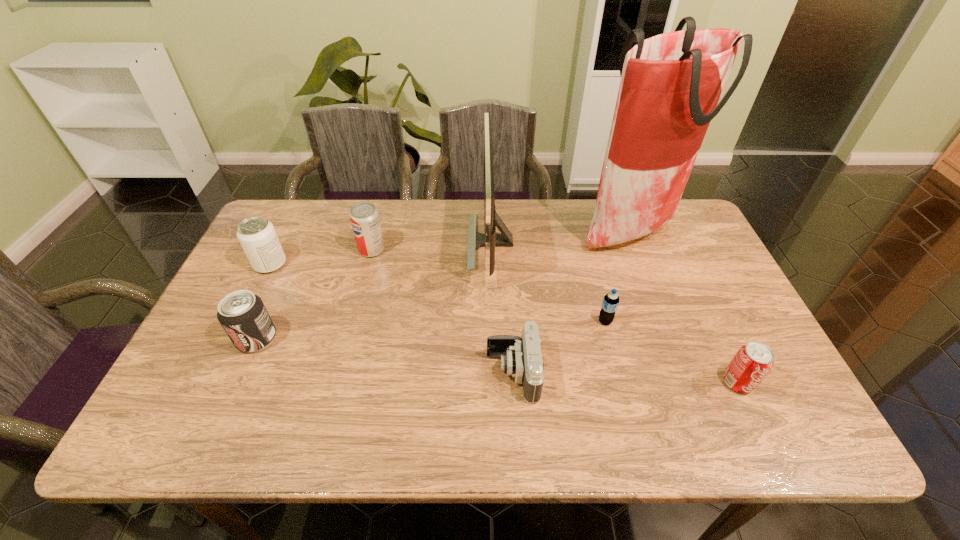
What are the coordinates of `soda located at the right edge` in the screenshot? It's located at (750, 365).

The image size is (960, 540). Identify the location of object present at the far right corner. click(x=671, y=83).

Locate an element on the screen. free region at the far edge of the desktop is located at coordinates (551, 224).

The height and width of the screenshot is (540, 960). What are the coordinates of `free space at the near edge of the desktop` in the screenshot? It's located at (322, 418).

Locate an element on the screen. This screenshot has height=540, width=960. free space at the right edge is located at coordinates (660, 255).

I want to click on vacant space at the near left corner of the desktop, so click(205, 415).

In the image, there is a desktop. At what (x,y) coordinates should I click in order to perform the action: click on free space at the far right corner. Please return your answer as a coordinate pair (x, y). This screenshot has width=960, height=540. Looking at the image, I should click on (695, 238).

Locate an element on the screen. This screenshot has height=540, width=960. empty space that is in between the monitor and the camera is located at coordinates click(x=502, y=308).

This screenshot has width=960, height=540. Find the location of `free space that is in between the third soda bottle from left to right and the camera`. free space that is in between the third soda bottle from left to right and the camera is located at coordinates (443, 312).

This screenshot has height=540, width=960. I want to click on blank region between the monitor and the tallest object, so click(x=562, y=236).